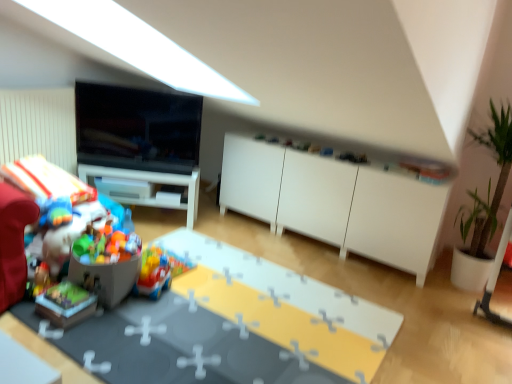
What are the coordinates of `free space between plastic colorful toys at lower left, marked as the second toy in a right-to-left arrangement, and translucent plastic toy car at center, which is the 1th toy from right to left` in the screenshot? It's located at (139, 302).